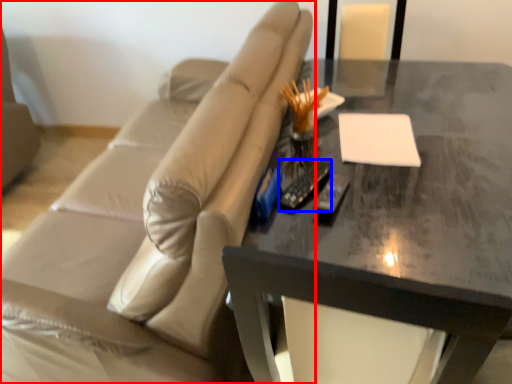
Question: Which of the following is the closest to the observer, studio couch (highlighted by a red box) or remote (highlighted by a blue box)?

Choices:
 (A) studio couch
 (B) remote

Answer: (A)